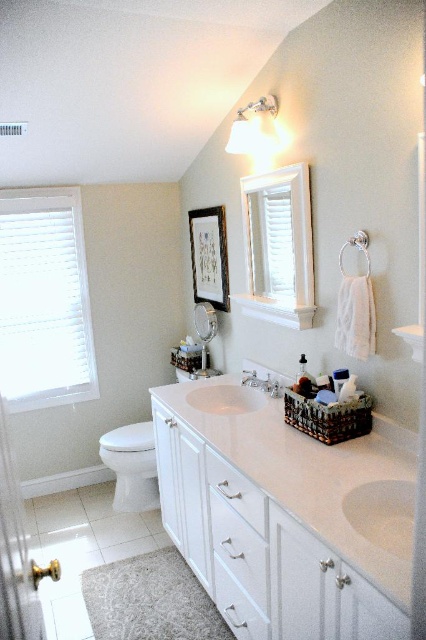
Is white glossy countertop at center thinner than clear glass screen door at lower left?

No.

Is point (406, 506) farther from camera compared to point (14, 561)?

Yes, it is.

Where is `white glossy countertop at center`? This screenshot has width=426, height=640. white glossy countertop at center is located at coordinates (313, 476).

Between white glossy countertop at center and matte glass mirror at upper center, which one appears on the left side from the viewer's perspective?

Positioned to the left is matte glass mirror at upper center.

Can you confirm if white glossy countertop at center is bigger than matte glass mirror at upper center?

Yes, white glossy countertop at center is bigger than matte glass mirror at upper center.

Is point (219, 426) closer to camera compared to point (201, 324)?

Yes, it is in front of point (201, 324).

Identify the location of white glossy countertop at center. This screenshot has height=640, width=426. (313, 476).

Who is taller, white glossy toilet bowl at lower left or white glossy sink at center?

With more height is white glossy toilet bowl at lower left.

Is white glossy toilet bowl at lower left shorter than white glossy sink at center?

Incorrect, white glossy toilet bowl at lower left's height does not fall short of white glossy sink at center's.

Is point (120, 449) closer to camera compared to point (209, 380)?

No, it is behind (209, 380).

Identify the location of white glossy toilet bowl at lower left. The image size is (426, 640). (132, 467).